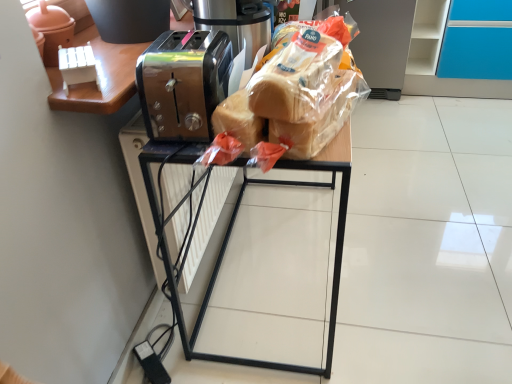
Identify the location of vacant space in metallic toaster at center (from a real-world perspective). This screenshot has height=384, width=512. (279, 263).